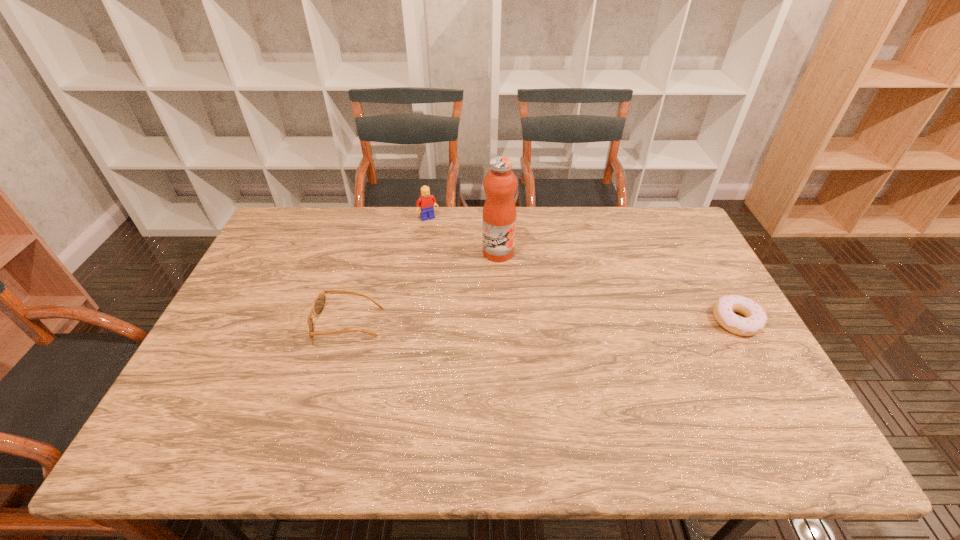
The image size is (960, 540). I want to click on the third tallest object, so click(x=319, y=303).

What are the coordinates of `sunglasses` in the screenshot? It's located at (319, 303).

This screenshot has width=960, height=540. What are the coordinates of `the shortest object` in the screenshot? It's located at (755, 321).

I want to click on doughnut, so click(755, 321).

Where is `the third object from left to right`? the third object from left to right is located at coordinates (500, 183).

Locate an element on the screen. the second farthest object is located at coordinates click(x=500, y=183).

At what (x,y) coordinates should I click in order to perform the action: click on Lego. Please return your answer as a coordinate pair (x, y). This screenshot has height=540, width=960. Looking at the image, I should click on (427, 202).

What are the coordinates of `the third object from right to left` in the screenshot? It's located at (427, 202).

You are a GUI agent. You are given a task and a screenshot of the screen. Output one action in this format:
    pyautogui.click(x=<x>, y=<y>)
    Task: Click on the free space located 0.080m on the front-facing side of the leftmost object
    The image size is (960, 540).
    Given the screenshot: What is the action you would take?
    pyautogui.click(x=286, y=324)

Find the location of `vacant space situated 0.240m on the front-facing side of the leftmost object`. vacant space situated 0.240m on the front-facing side of the leftmost object is located at coordinates (228, 324).